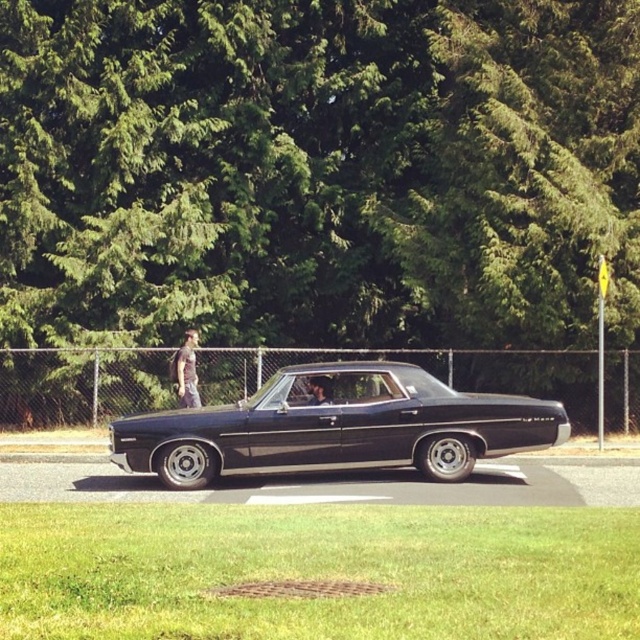
You are a delivery person trying to park a shiny black car at center in a narrow alley. The alley is only as wide as the gray fabric jacket at left. Will the car fit?

The shiny black car at center might be wider than gray fabric jacket at left, so it may not fit in the alley.

You are a photographer trying to capture a photo of the shiny black car at center and the gray fabric jacket at left. Since you want to ensure both are in focus, you need to know which object is taller. Can you tell me which one is taller?

The shiny black car at center is taller than the gray fabric jacket at left according to the description.

You are standing in front of the vintage black car and want to place a small decoration on the point that is closer to you. Which point should you choose between the point at coordinates point (403, 464) and point (186, 349)?

You should choose point (403, 464) because it is closer to the viewer than point (186, 349).